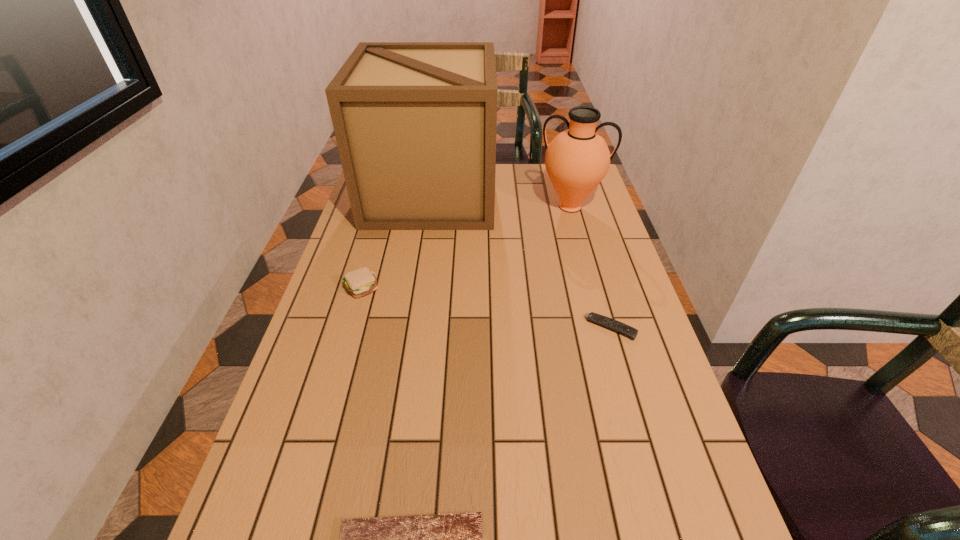
You are a GUI agent. You are given a task and a screenshot of the screen. Output one action in this format:
    pyautogui.click(x=<x>, y=<y>)
    Task: Click on the vacant region that satisfies the following two spatial constraints: 1. on the front side of the third nearest object; 2. on the left side of the second nearest object
    This screenshot has width=960, height=540.
    Given the screenshot: What is the action you would take?
    pyautogui.click(x=349, y=328)

You are a GUI agent. You are given a task and a screenshot of the screen. Output one action in this format:
    pyautogui.click(x=<x>, y=<y>)
    Task: Click on the free space that satisfies the following two spatial constraints: 1. on the back side of the remote control; 2. on the reinforced sides of the box
    The image size is (960, 540).
    Given the screenshot: What is the action you would take?
    pyautogui.click(x=572, y=194)

The width and height of the screenshot is (960, 540). Find the location of `free point that satisfies the following two spatial constraints: 1. on the reinforced sides of the tallest object; 2. on the right side of the pitcher`. free point that satisfies the following two spatial constraints: 1. on the reinforced sides of the tallest object; 2. on the right side of the pitcher is located at coordinates (429, 207).